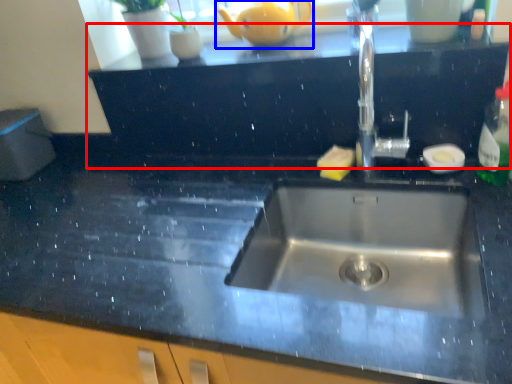
Question: Which of the following is the farthest to the observer, dresser (highlighted by a red box) or tea pot (highlighted by a blue box)?

Choices:
 (A) dresser
 (B) tea pot

Answer: (B)